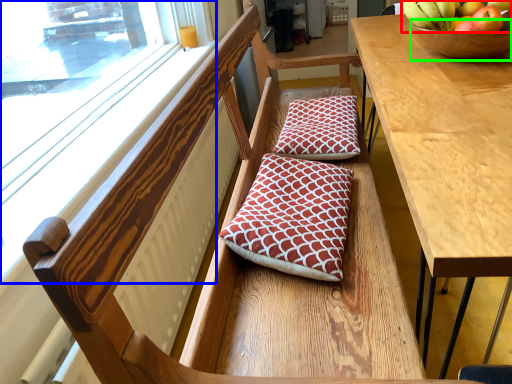
Question: Based on their relative distances, which object is nearer to banana (highlighted by a red box)? Choose from window (highlighted by a blue box) and glass bowl (highlighted by a green box).

Choices:
 (A) window
 (B) glass bowl

Answer: (B)